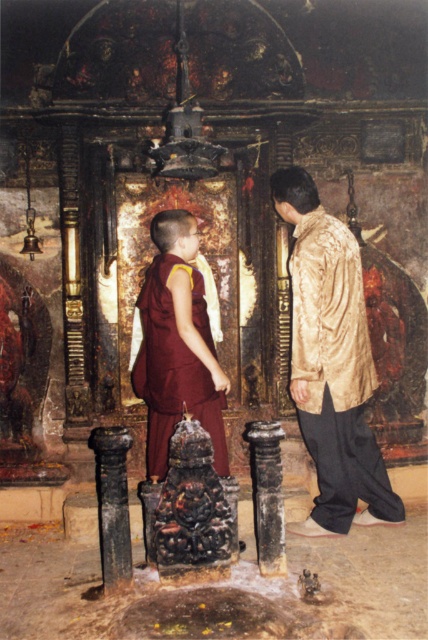
Who is more distant from viewer, (323, 426) or (145, 285)?

The point (145, 285) is behind.

Is point (317, 506) positioned after point (151, 342)?

That is True.

Image resolution: width=428 pixels, height=640 pixels. Find the location of `gold silk robe at right`. gold silk robe at right is located at coordinates (332, 364).